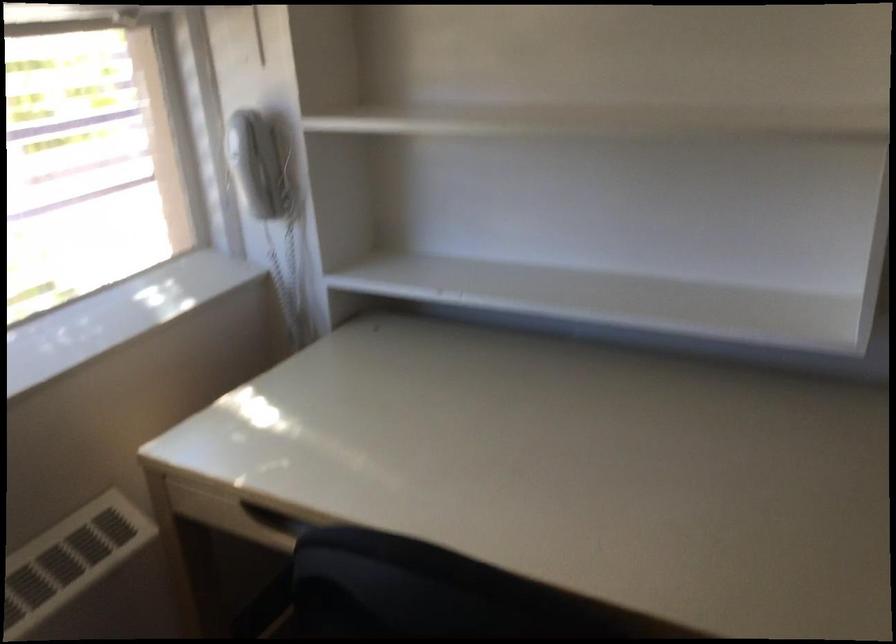
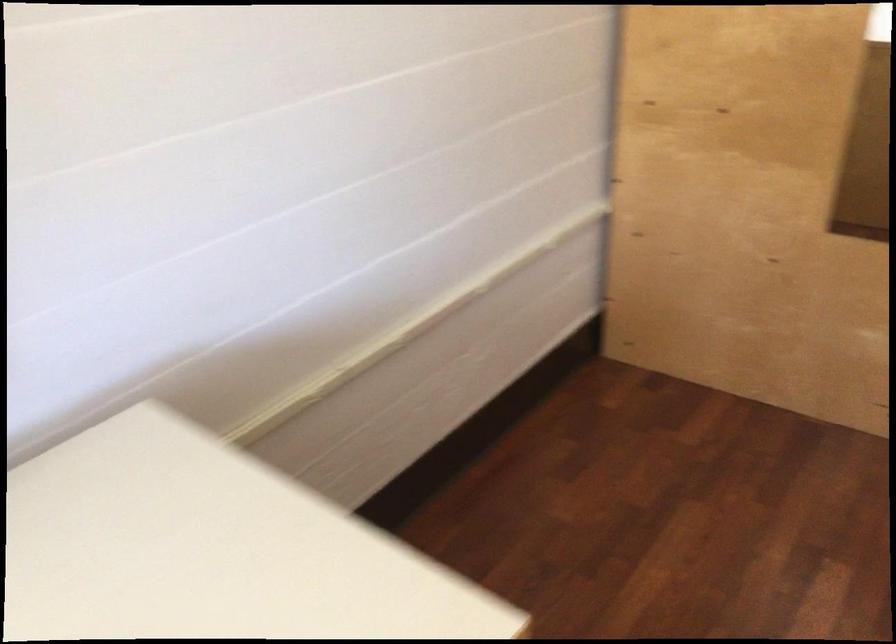
The images are taken continuously from a first-person perspective. In which direction is your viewpoint rotating?

The camera rotated toward right-down.